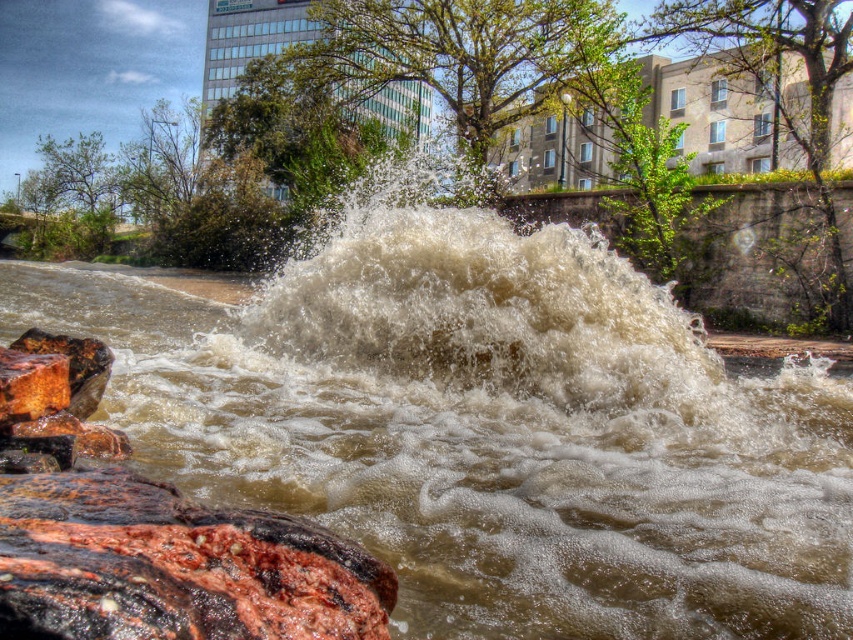
Can you confirm if brown foamy water at center is smaller than frothy white water at center?

Incorrect, brown foamy water at center is not smaller in size than frothy white water at center.

Between brown foamy water at center and frothy white water at center, which one has less height?

With less height is frothy white water at center.

Is point (30, 269) less distant than point (396, 342)?

No, (30, 269) is further to viewer.

Identify the location of brown foamy water at center. (490, 442).